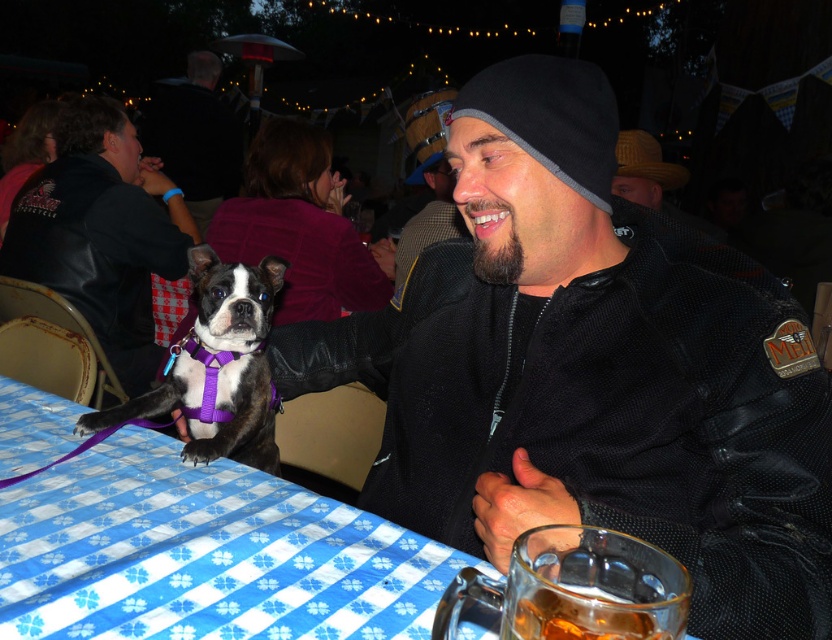
Does point (109, 189) come in front of point (197, 52)?

Yes.

Is black leather jacket at left shorter than matte black jacket at upper left?

Correct, black leather jacket at left is not as tall as matte black jacket at upper left.

The image size is (832, 640). What do you see at coordinates (102, 232) in the screenshot? I see `black leather jacket at left` at bounding box center [102, 232].

Find the location of `black leather jacket at left`. black leather jacket at left is located at coordinates (102, 232).

Does blue checkered tablecloth at lower left have a greater height compared to black leather jacket at left?

Incorrect, blue checkered tablecloth at lower left's height is not larger of black leather jacket at left's.

Is point (106, 589) behind point (182, 225)?

That is False.

This screenshot has height=640, width=832. What are the coordinates of `blue checkered tablecloth at lower left` in the screenshot? It's located at (204, 554).

Does black leather jacket at left have a lesser height compared to translucent glass mug at lower right?

In fact, black leather jacket at left may be taller than translucent glass mug at lower right.

Locate an element on the screen. black leather jacket at left is located at coordinates (102, 232).

The width and height of the screenshot is (832, 640). I want to click on black leather jacket at left, so click(x=102, y=232).